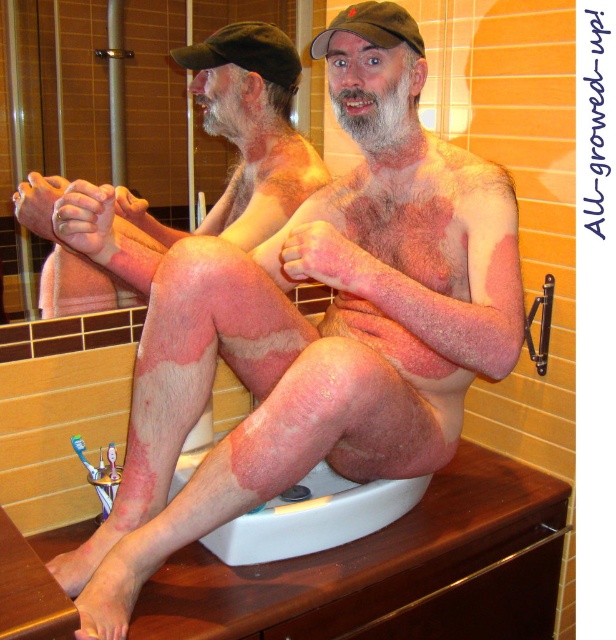
Between smooth skin man at center and white plastic sink at lower center, which one appears on the left side from the viewer's perspective?

smooth skin man at center

Describe the element at coordinates (240, 138) in the screenshot. I see `smooth skin man at center` at that location.

Is point (282, 74) closer to viewer compared to point (285, 513)?

No, (282, 74) is behind (285, 513).

Identify the location of smooth skin man at center. (240, 138).